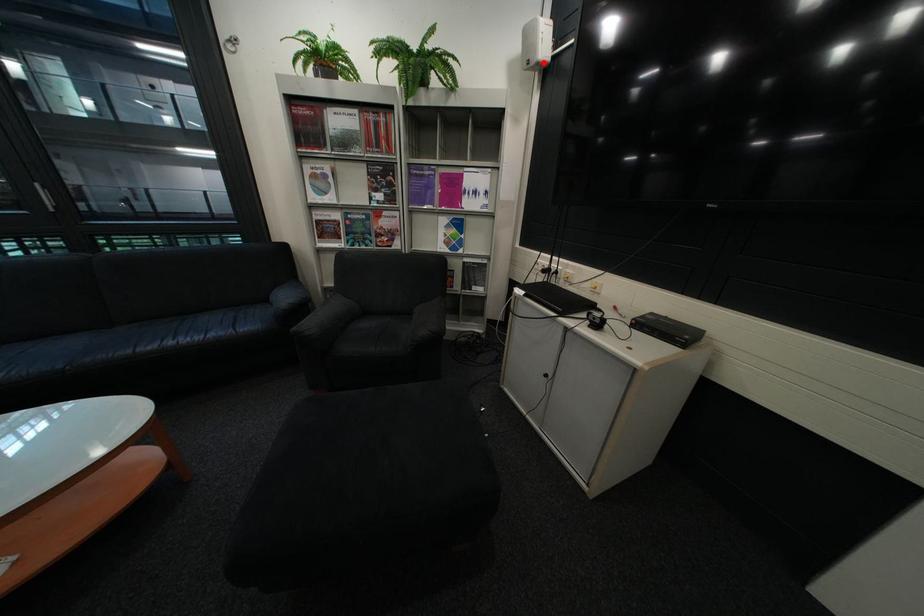
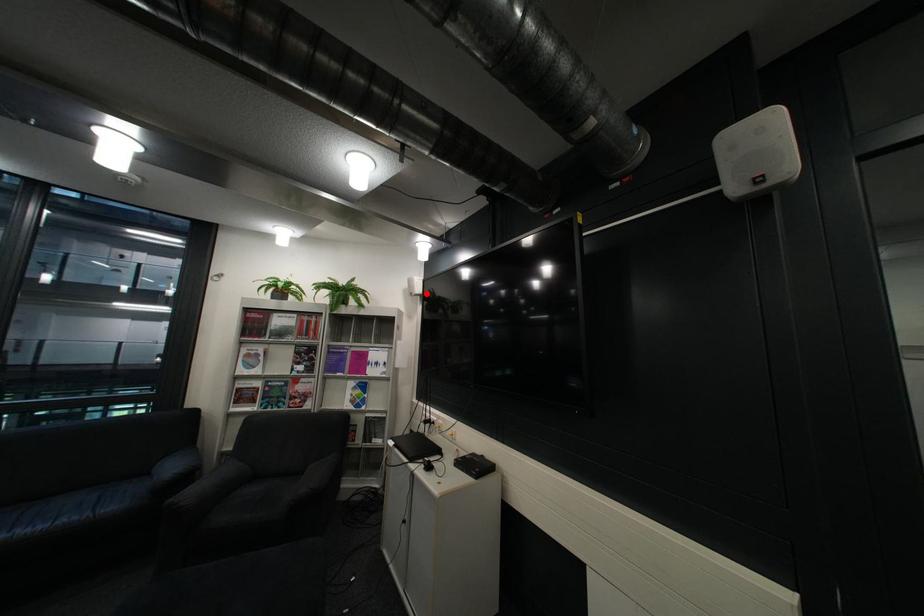
I am providing you with two images of the same scene from different viewpoints. A red point is marked on the first image and another point is marked on the second image. Is the red point in image1 aligned with the point shown in image2?

Yes